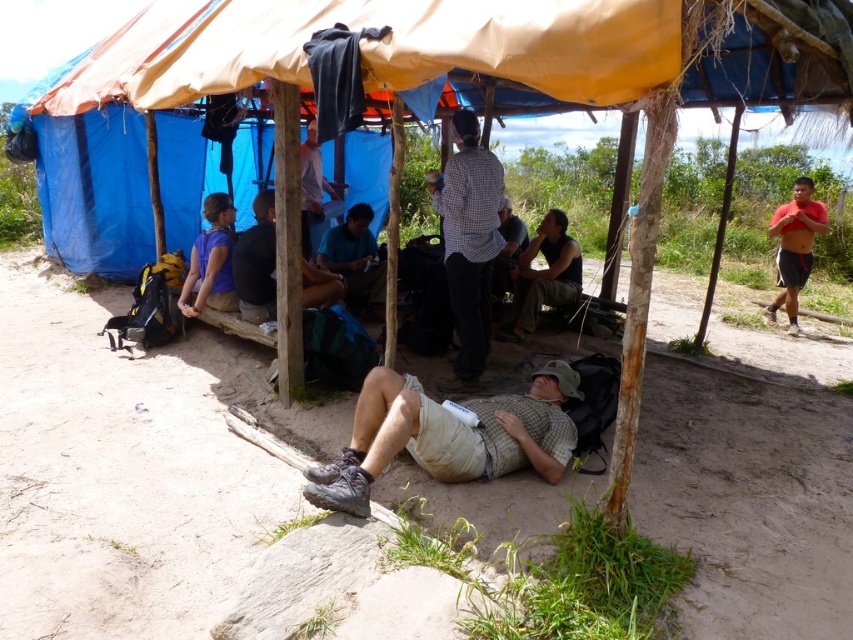
Who is more forward, (517, 445) or (450, 212)?

Positioned in front is point (517, 445).

Between tan canvas sleeping bag at lower center and checkered fabric shirt at center, which one is positioned lower?

Positioned lower is tan canvas sleeping bag at lower center.

Does point (432, 440) come farther from viewer compared to point (469, 195)?

No, (432, 440) is closer to viewer.

The height and width of the screenshot is (640, 853). In order to click on tan canvas sleeping bag at lower center in this screenshot , I will do `click(448, 435)`.

Does black fabric shirt at center have a greater width compared to light brown wooden bench at center?

Indeed, black fabric shirt at center has a greater width compared to light brown wooden bench at center.

Who is shorter, black fabric shirt at center or light brown wooden bench at center?

black fabric shirt at center

Does point (535, 244) lie behind point (318, 170)?

No, (535, 244) is in front of (318, 170).

Image resolution: width=853 pixels, height=640 pixels. Identify the location of black fabric shirt at center. (544, 275).

Is point (793, 273) positioned before point (221, 268)?

That is False.

Who is more forward, (824,220) or (206,196)?

Point (824,220)

Which is in front, point (810, 220) or point (227, 296)?

Point (227, 296)

Where is `orange shirtless man at right`? orange shirtless man at right is located at coordinates (793, 246).